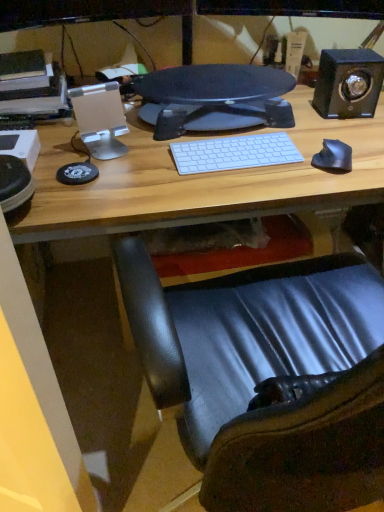
What are the coordinates of `vacant area that lies to the right of white matte keyboard at center` in the screenshot? It's located at (315, 165).